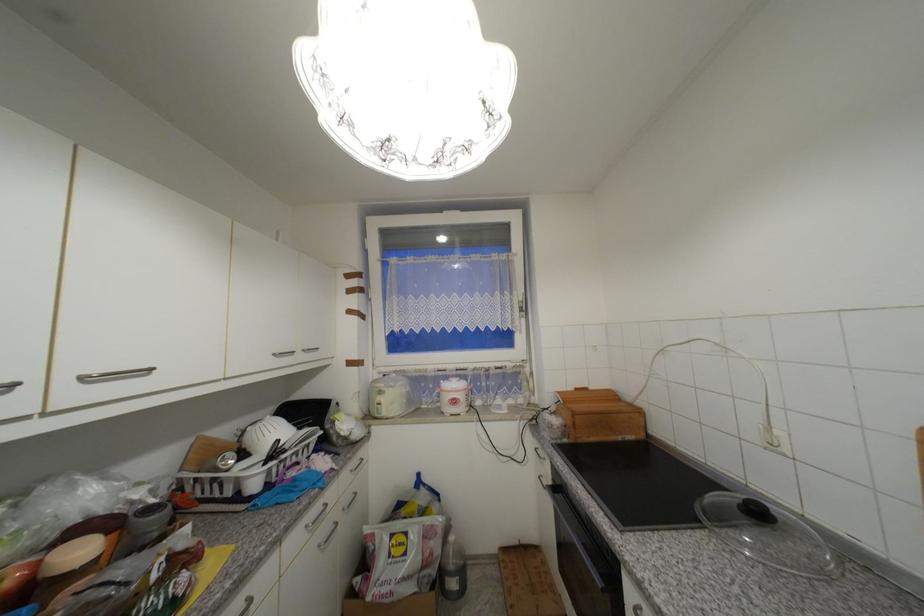
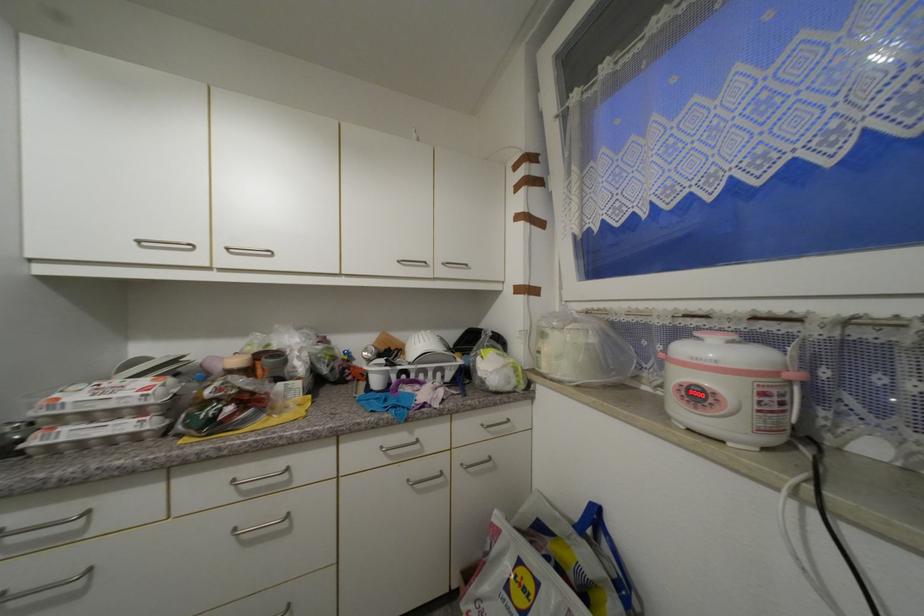
Where in the second image is the point corresponding to point 348,511 from the first image?

(468, 467)